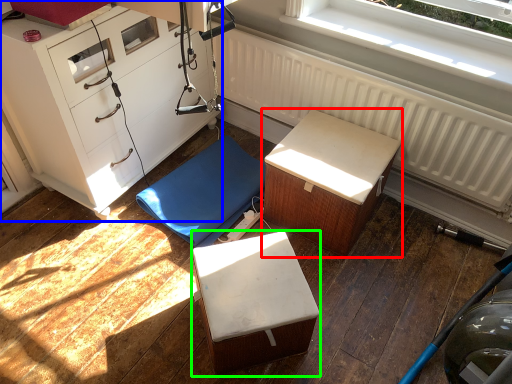
Question: Which object is the farthest from furniture (highlighted by a red box)? Choose among these: chest of drawers (highlighted by a blue box) or furniture (highlighted by a green box).

Choices:
 (A) chest of drawers
 (B) furniture

Answer: (A)